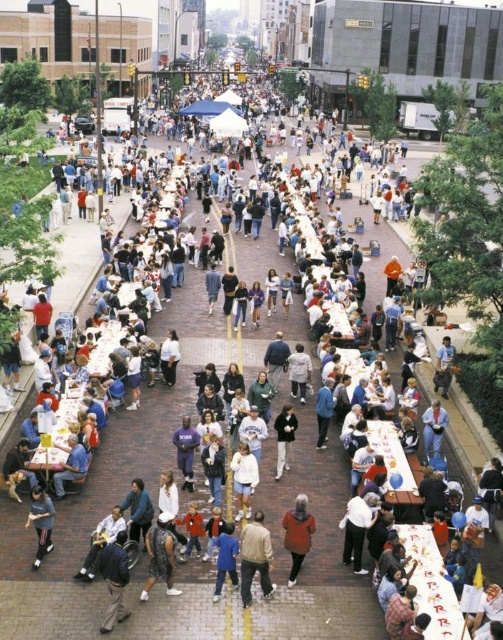
Question: Which object appears closest to the camera in this image?

Choices:
 (A) tan leather jacket at center
 (B) orange fleece jacket at center
 (C) dark gray sweater at center
 (D) light gray fabric jacket at center

Answer: (A)

Question: Which point is closer to the camera?

Choices:
 (A) tan leather jacket at center
 (B) light gray fabric jacket at center

Answer: (A)

Question: Which point is farther to the camera?

Choices:
 (A) tap(303, 381)
 (B) tap(300, 557)
 (C) tap(247, 589)

Answer: (A)

Question: Is patterned fabric dress at center above light gray fabric jacket at center?

Choices:
 (A) no
 (B) yes

Answer: (A)

Question: Considering the relative positions of white matte shorts at center and dark gray sweater at center in the image provided, where is white matte shorts at center located with respect to dark gray sweater at center?

Choices:
 (A) left
 (B) right

Answer: (A)

Question: Does tan leather jacket at center have a lesser width compared to white matte shorts at center?

Choices:
 (A) no
 (B) yes

Answer: (A)